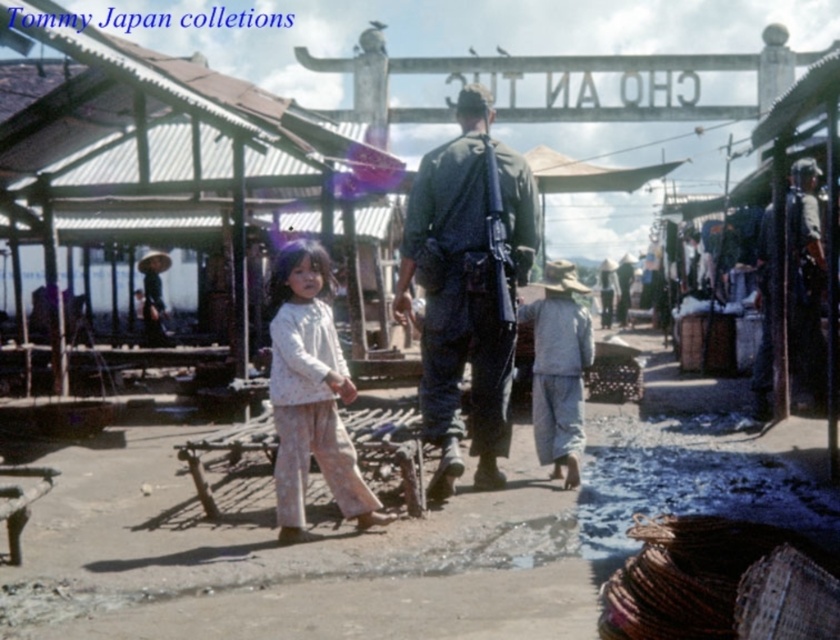
Does dark green uniform at center appear on the right side of gray cotton hat at center?

No, dark green uniform at center is not to the right of gray cotton hat at center.

Who is positioned more to the left, dark green uniform at center or gray cotton hat at center?

From the viewer's perspective, dark green uniform at center appears more on the left side.

Where is `dark green uniform at center`? Image resolution: width=840 pixels, height=640 pixels. dark green uniform at center is located at coordinates (457, 300).

Can you confirm if white floral dress at center is thinner than gray cotton hat at center?

In fact, white floral dress at center might be wider than gray cotton hat at center.

Which is in front, point (315, 294) or point (525, 321)?

Positioned in front is point (315, 294).

This screenshot has height=640, width=840. What do you see at coordinates (310, 394) in the screenshot?
I see `white floral dress at center` at bounding box center [310, 394].

Locate an element on the screen. This screenshot has width=840, height=640. white floral dress at center is located at coordinates (310, 394).

Can you confirm if dark green uniform at center is positioned to the right of white floral dress at center?

Correct, you'll find dark green uniform at center to the right of white floral dress at center.

This screenshot has height=640, width=840. What do you see at coordinates (457, 300) in the screenshot?
I see `dark green uniform at center` at bounding box center [457, 300].

The image size is (840, 640). What do you see at coordinates (457, 300) in the screenshot? I see `dark green uniform at center` at bounding box center [457, 300].

The width and height of the screenshot is (840, 640). What are the coordinates of `dark green uniform at center` in the screenshot? It's located at (457, 300).